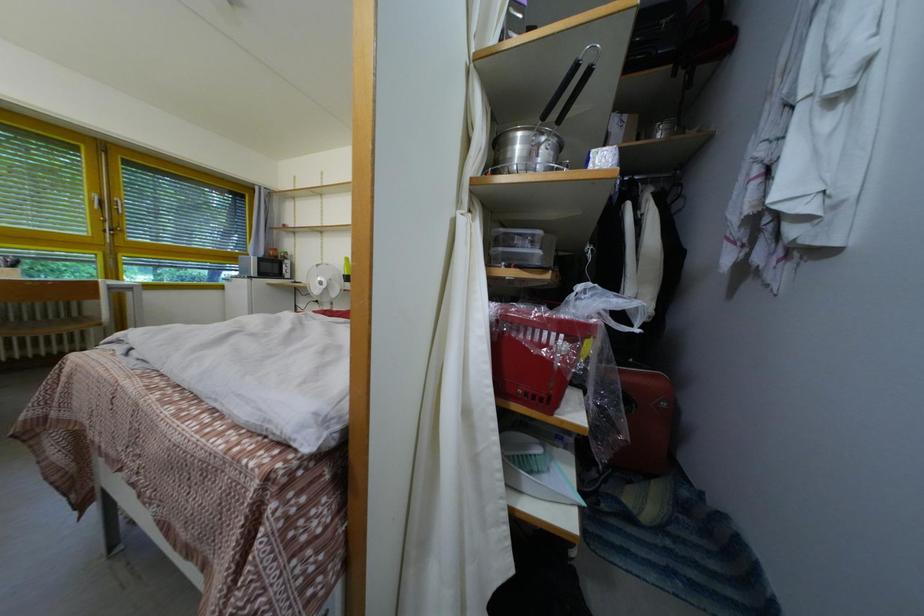
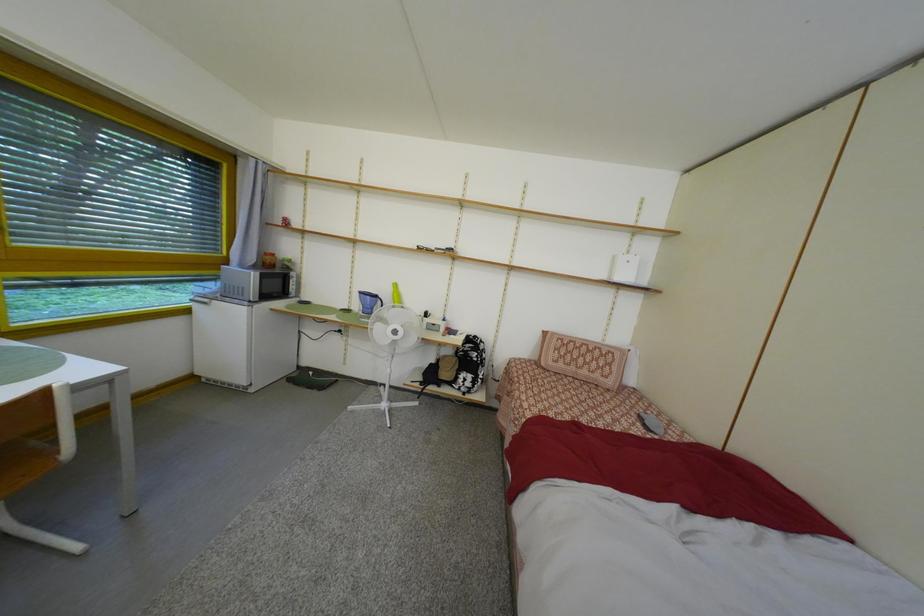
The images are taken continuously from a first-person perspective. In which direction are you moving?

The movement direction of the cameraman is left, forward.